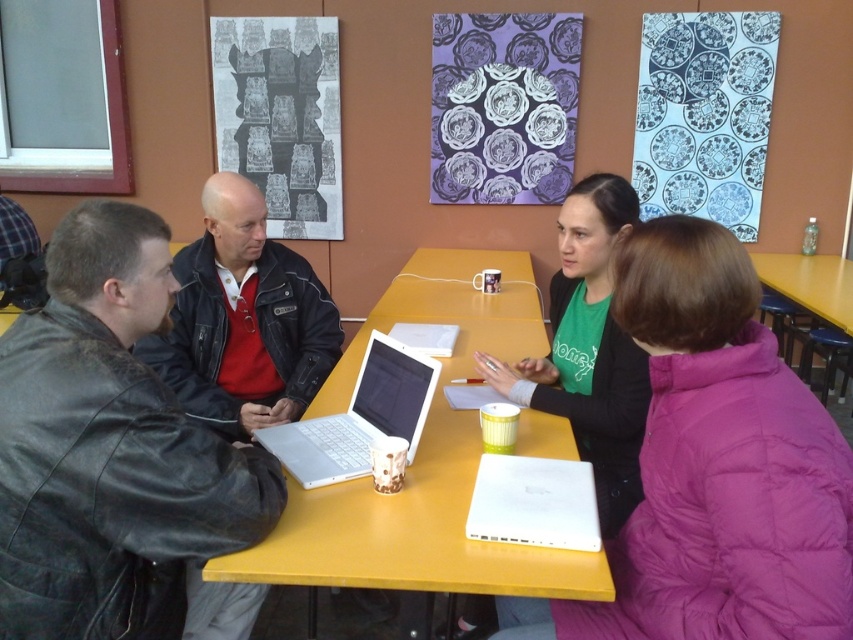
Question: Is black leather jacket at upper left above white plastic laptop at center?

Choices:
 (A) yes
 (B) no

Answer: (B)

Question: Estimate the real-world distances between objects in this image. Which object is farther from the black leather jacket at upper left?

Choices:
 (A) white plastic laptop at center
 (B) yellow plastic table at lower right
 (C) leather jacket at center

Answer: (B)

Question: Does leather jacket at center lie behind white plastic laptop at center?

Choices:
 (A) no
 (B) yes

Answer: (B)

Question: Which point is closer to the camera?

Choices:
 (A) yellow plastic table at lower right
 (B) white matte laptop at lower center

Answer: (B)

Question: Does black leather jacket at upper left lie behind yellow plastic table at lower right?

Choices:
 (A) yes
 (B) no

Answer: (B)

Question: Which point is closer to the camera?

Choices:
 (A) (633, 202)
 (B) (769, 273)

Answer: (A)